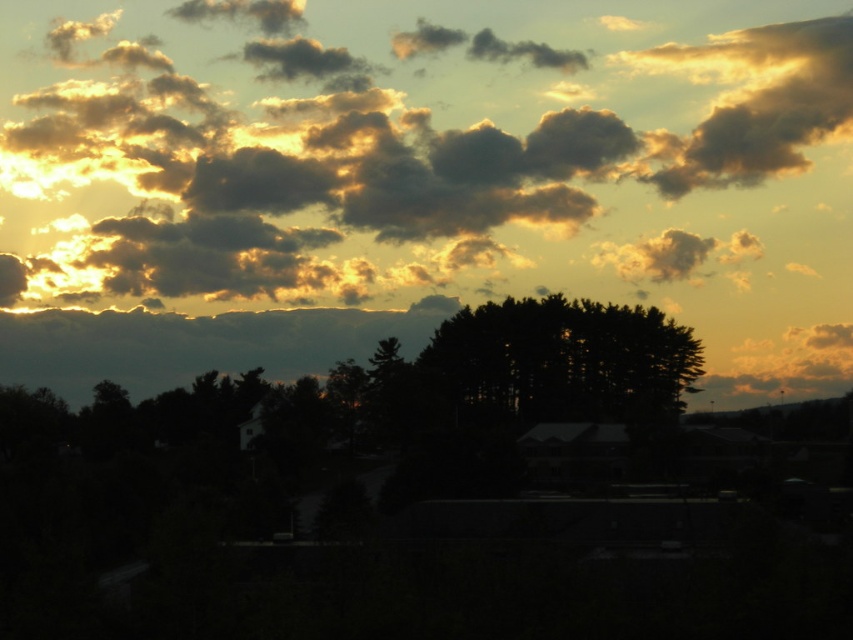
You are an artist painting the sunset scene. You want to ensure the golden fluffy cloud at upper center and the black matte tree at center are proportionally accurate. Which object should you paint taller?

The golden fluffy cloud at upper center should be painted taller since it has a greater height compared to the black matte tree at center according to the description.

You are an artist painting the sunset scene. You want to ensure the golden fluffy cloud at upper center and the black matte tree at center are proportionally accurate. Based on the scene, which object should you draw wider?

The golden fluffy cloud at upper center should be drawn wider because its width is larger than the black matte tree at center.